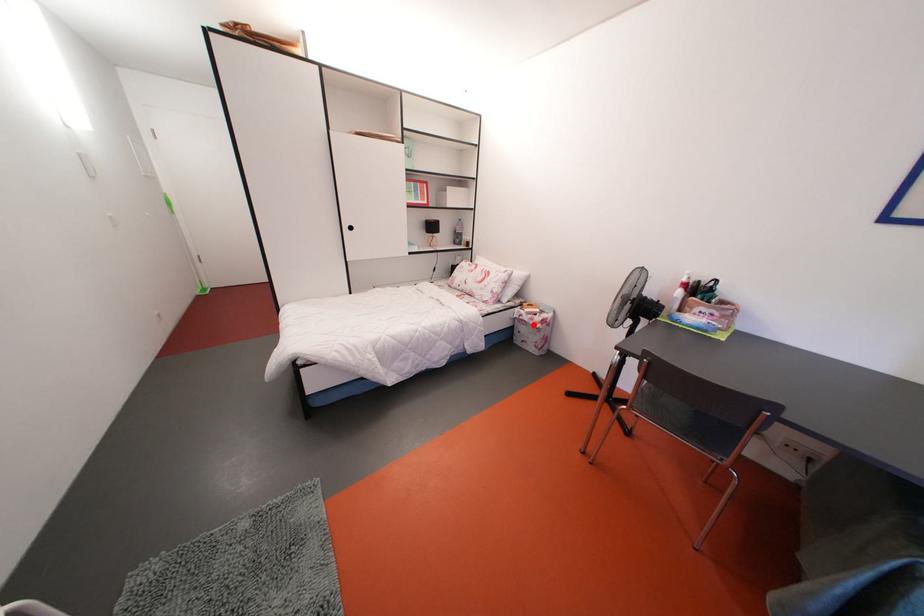
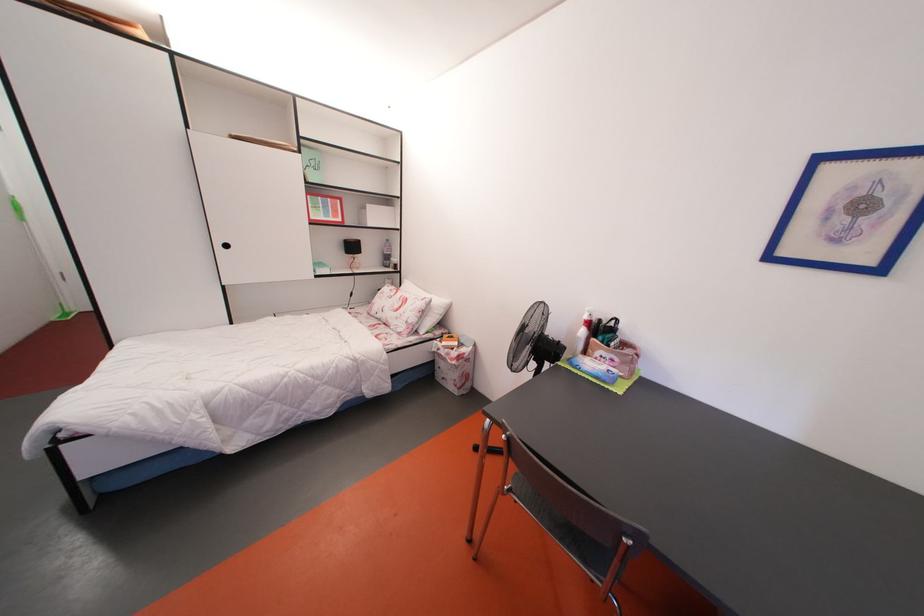
Locate, in the second image, the point that corresponds to the highlighted location in the first image.

(450, 360)